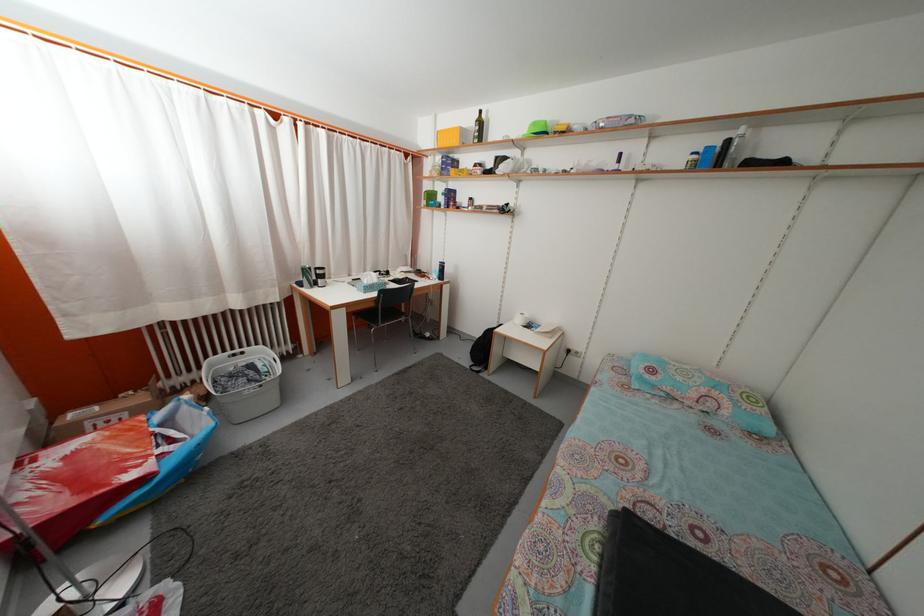
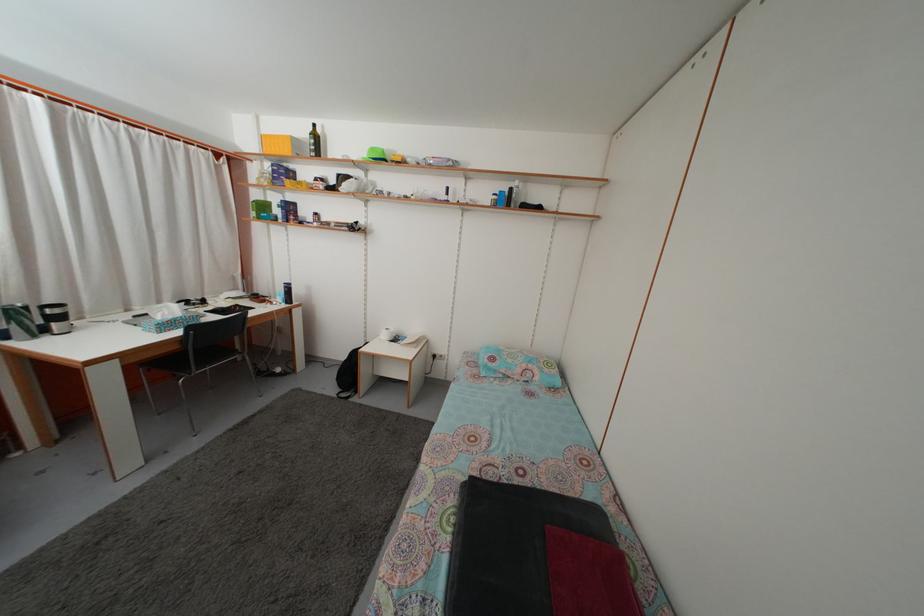
Question: How did the camera likely rotate?

Choices:
 (A) Left
 (B) Right
 (C) Up
 (D) Down

Answer: (B)